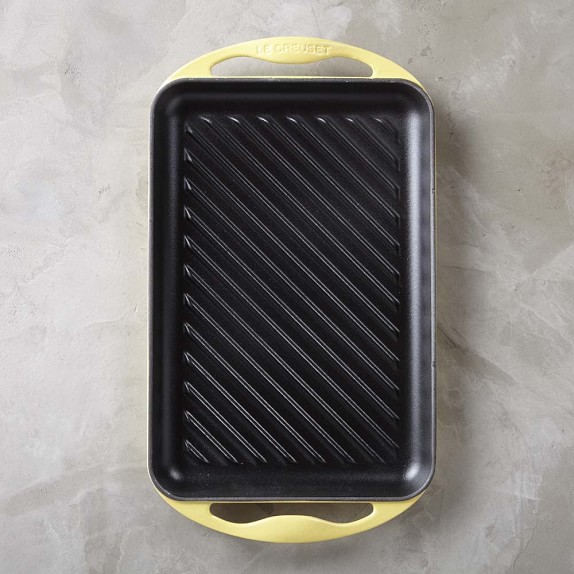
Identify the location of baking pan. (315, 126).